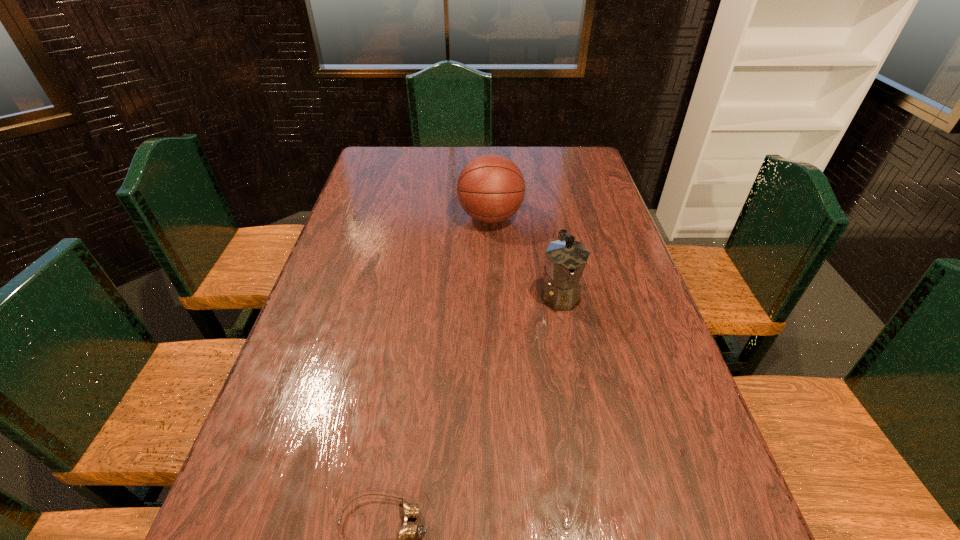
You are a GUI agent. You are given a task and a screenshot of the screen. Output one action in this format:
    pyautogui.click(x=<x>, y=<y>)
    Task: Click on the free space between the coffeepot and the farthest object
    The width and height of the screenshot is (960, 540).
    Given the screenshot: What is the action you would take?
    pyautogui.click(x=525, y=256)

The image size is (960, 540). In order to click on free space between the rightmost object and the second object from left to right in this screenshot , I will do `click(525, 256)`.

Locate an element on the screen. The width and height of the screenshot is (960, 540). object that is the second nearest to the farthest object is located at coordinates (407, 530).

Select which object appears as the closest to the shortest object. Please provide its 2D coordinates. Your answer should be formatted as a tuple, i.e. [(x, y)], where the tuple contains the x and y coordinates of a point satisfying the conditions above.

[(566, 259)]